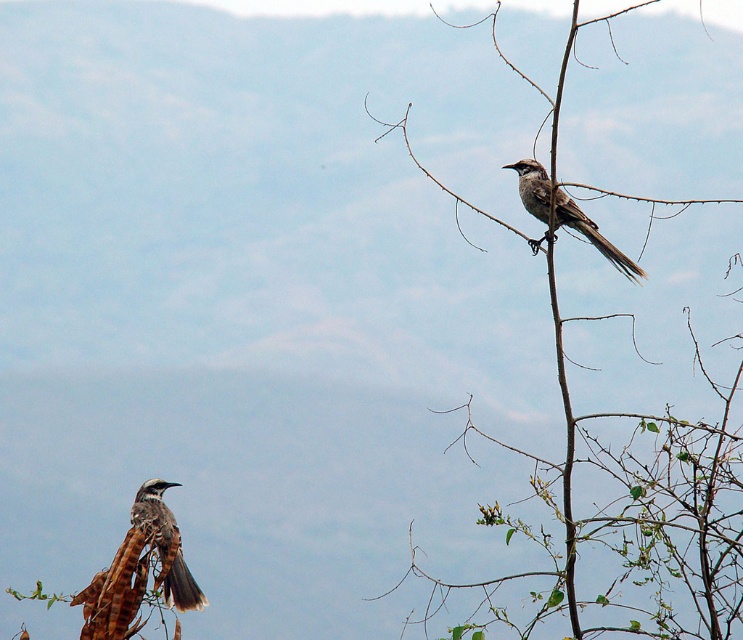
Is gray-brown speckled bird at upper right above brown speckled feathers at lower left?

Indeed, gray-brown speckled bird at upper right is positioned over brown speckled feathers at lower left.

Between gray-brown speckled bird at upper right and brown speckled feathers at lower left, which one is positioned lower?

brown speckled feathers at lower left is below.

Is point (541, 237) positioned behind point (165, 580)?

Yes, it is behind point (165, 580).

Locate an element on the screen. The width and height of the screenshot is (743, 640). gray-brown speckled bird at upper right is located at coordinates (591, 234).

Is brown textured branch at upper center thinner than brown speckled feathers at lower left?

No, brown textured branch at upper center is not thinner than brown speckled feathers at lower left.

Is brown textured branch at upper center to the left of brown speckled feathers at lower left from the viewer's perspective?

In fact, brown textured branch at upper center is to the right of brown speckled feathers at lower left.

Who is more forward, (x=658, y=458) or (x=146, y=518)?

Point (x=658, y=458) is more forward.

I want to click on brown textured branch at upper center, so click(616, 474).

Does brown textured branch at upper center appear under gray-brown speckled bird at upper right?

Yes.

In the scene shown: Can you confirm if brown textured branch at upper center is positioned to the right of gray-brown speckled bird at upper right?

Correct, you'll find brown textured branch at upper center to the right of gray-brown speckled bird at upper right.

Does point (697, 577) come in front of point (525, 182)?

Yes, point (697, 577) is in front of point (525, 182).

What are the coordinates of `brown textured branch at upper center` in the screenshot? It's located at (616, 474).